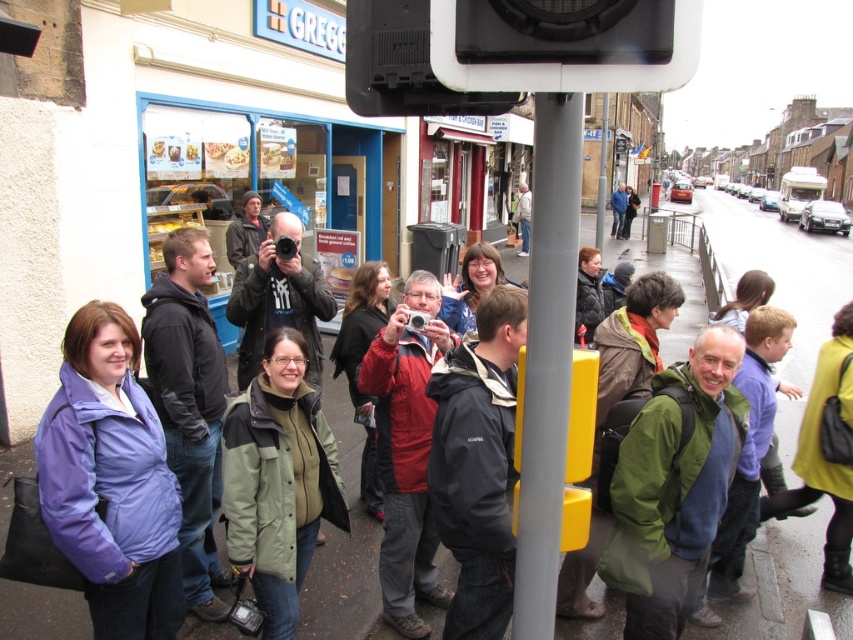
Question: Which is nearer to the purple fabric jacket at lower left?

Choices:
 (A) red matte jacket at center
 (B) dark gray hoodie at center
 (C) light brown leather jacket at center

Answer: (C)

Question: Is red matte jacket at center thinner than matte black jacket at center?

Choices:
 (A) no
 (B) yes

Answer: (B)

Question: Which object is positioned closest to the light brown leather jacket at center?

Choices:
 (A) green matte jacket at center
 (B) purple matte jacket at lower left
 (C) transparent plastic traffic light at upper center
 (D) red matte jacket at center

Answer: (D)

Question: Is smooth gray pole at center smaller than dark gray hoodie at center?

Choices:
 (A) yes
 (B) no

Answer: (A)

Question: Can you confirm if purple fabric jacket at lower left is bigger than matte black jacket at center?

Choices:
 (A) yes
 (B) no

Answer: (A)

Question: Which point appears farthest from the camera in this image?

Choices:
 (A) (659, 51)
 (B) (541, 577)

Answer: (B)